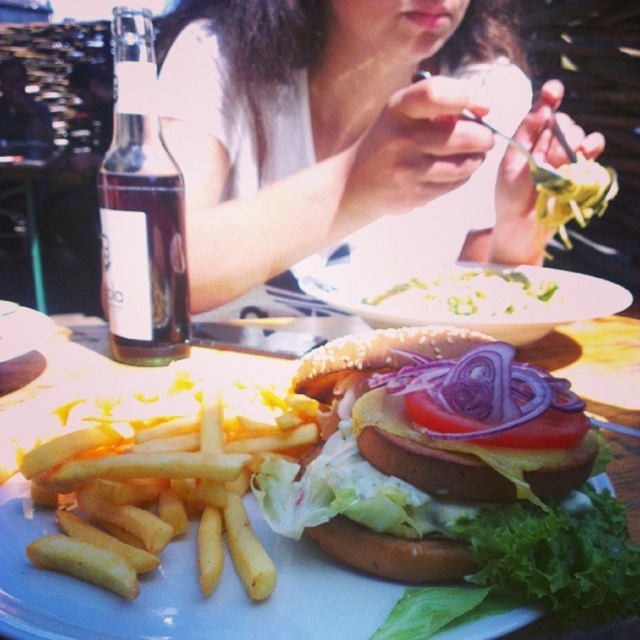
You are a photographer standing at the edge of the scene. You want to take a photo that includes both the matte white shirt at center and the shiny brown bun at center. Given that your camera has a maximum focus range of 20 inches, will you be able to capture both objects in focus without moving closer?

The matte white shirt at center and the shiny brown bun at center are 21.59 inches apart. Since the distance between them exceeds the camera focus range of 20 inches, you will not be able to capture both in focus without moving closer.

You are a food delivery person who needs to place a burger and fries on a tray. The burger has green leafy lettuce at lower center and must be placed on the white paper plate at center. How far apart should you place them to ensure they are correctly positioned?

The white paper plate at center is 8.55 inches from the green leafy lettuce at lower center, so you should place them approximately 8.55 inches apart to ensure correct positioning.